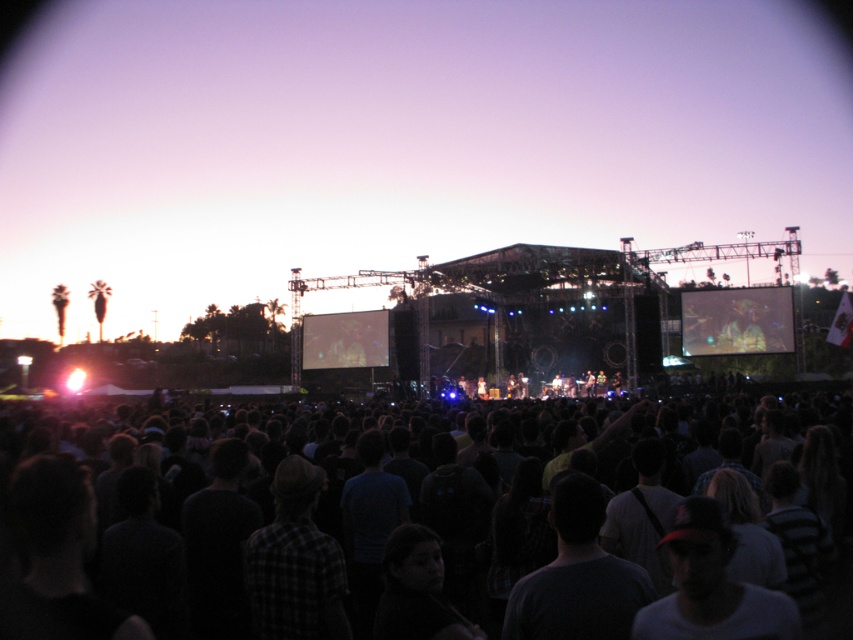
Question: Is dark casual clothing at center to the left of matte screen at center from the viewer's perspective?

Choices:
 (A) yes
 (B) no

Answer: (B)

Question: Which object is closer to the camera taking this photo?

Choices:
 (A) dark casual clothing at center
 (B) matte black screen at center
 (C) matte screen at center

Answer: (A)

Question: Where is dark casual clothing at center located in relation to matte screen at center in the image?

Choices:
 (A) right
 (B) left

Answer: (A)

Question: Can you confirm if dark casual clothing at center is wider than matte screen at center?

Choices:
 (A) no
 (B) yes

Answer: (B)

Question: Which object appears closest to the camera in this image?

Choices:
 (A) dark casual clothing at center
 (B) matte screen at center

Answer: (A)

Question: Which of the following is the closest to the observer?

Choices:
 (A) matte black screen at center
 (B) dark casual clothing at center
 (C) matte screen at center

Answer: (B)